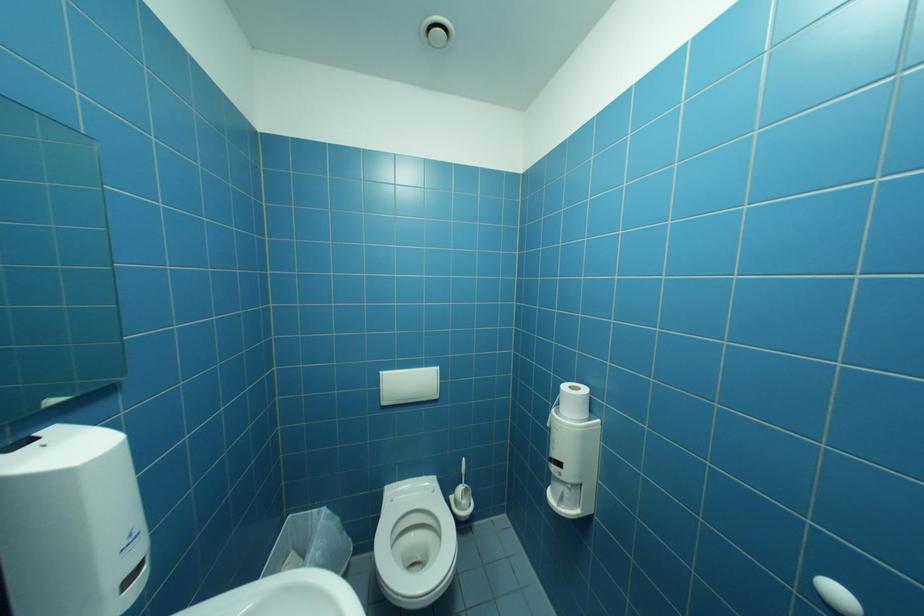
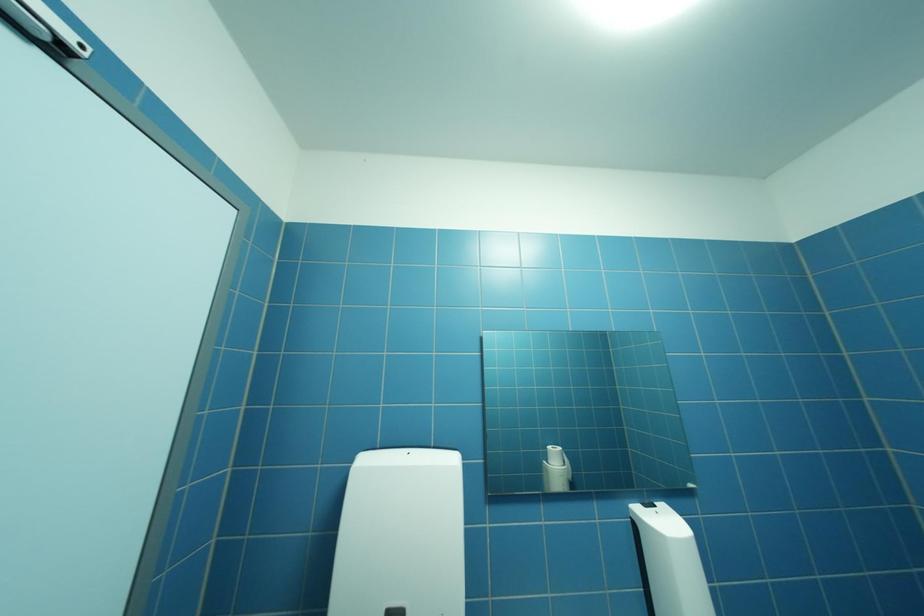
How did the camera likely rotate?

The camera rotated toward left-up.